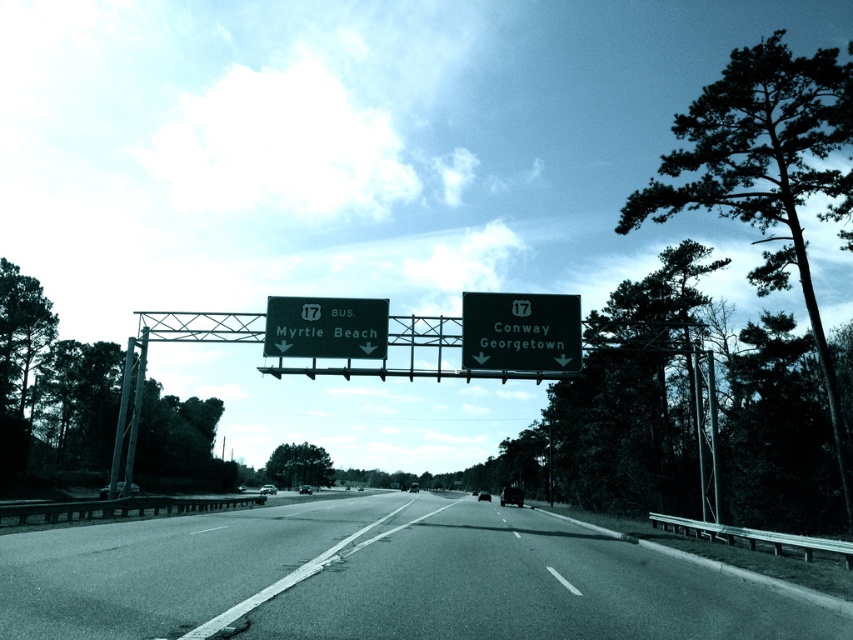
Question: Which object is positioned farthest from the asphalt road at center?

Choices:
 (A) green metallic sign at upper center
 (B) green matte sign at upper center

Answer: (B)

Question: Can you confirm if asphalt road at center is thinner than green matte sign at upper center?

Choices:
 (A) yes
 (B) no

Answer: (B)

Question: Which object is closer to the camera taking this photo?

Choices:
 (A) green matte sign at upper center
 (B) green metallic sign at upper center

Answer: (B)

Question: Which of these objects is positioned farthest from the green matte sign at upper center?

Choices:
 (A) asphalt road at center
 (B) green metallic sign at upper center

Answer: (A)

Question: Does asphalt road at center appear over green matte sign at upper center?

Choices:
 (A) yes
 (B) no

Answer: (B)

Question: Can you confirm if asphalt road at center is positioned to the left of green metallic sign at upper center?

Choices:
 (A) no
 (B) yes

Answer: (B)